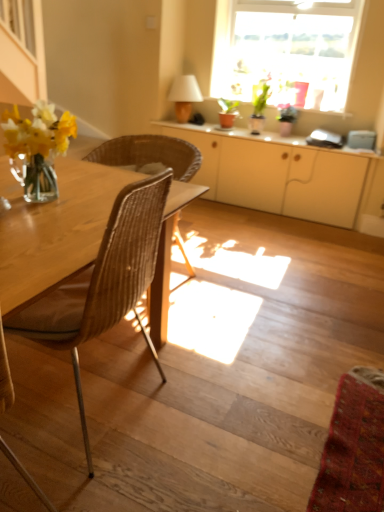
Question: Should I look upward or downward to see white glossy cabinet at center?

Choices:
 (A) down
 (B) up

Answer: (B)

Question: Should I look upward or downward to see brown woven chair at left?

Choices:
 (A) down
 (B) up

Answer: (A)

Question: Does woven wood chair at left appear on the right side of matte white cabinet at center?

Choices:
 (A) no
 (B) yes

Answer: (A)

Question: Considering the relative sizes of woven wood chair at left and matte white cabinet at center in the image provided, is woven wood chair at left thinner than matte white cabinet at center?

Choices:
 (A) no
 (B) yes

Answer: (A)

Question: Is woven wood chair at left smaller than matte white cabinet at center?

Choices:
 (A) no
 (B) yes

Answer: (B)

Question: Is there a large distance between woven wood chair at left and matte white cabinet at center?

Choices:
 (A) no
 (B) yes

Answer: (B)

Question: Can you confirm if woven wood chair at left is taller than matte white cabinet at center?

Choices:
 (A) yes
 (B) no

Answer: (A)

Question: Can you confirm if woven wood chair at left is shorter than matte white cabinet at center?

Choices:
 (A) no
 (B) yes

Answer: (A)

Question: From the image's perspective, does woven wood chair at left appear lower than wooden stairs at lower left?

Choices:
 (A) no
 (B) yes

Answer: (A)

Question: Is woven wood chair at left positioned far away from wooden stairs at lower left?

Choices:
 (A) yes
 (B) no

Answer: (B)

Question: Can wooden stairs at lower left be found inside woven wood chair at left?

Choices:
 (A) no
 (B) yes

Answer: (A)

Question: Is woven wood chair at left in contact with wooden stairs at lower left?

Choices:
 (A) no
 (B) yes

Answer: (A)

Question: From a real-world perspective, is woven wood chair at left on wooden stairs at lower left?

Choices:
 (A) yes
 (B) no

Answer: (A)

Question: Can you confirm if woven wood chair at left is smaller than wooden stairs at lower left?

Choices:
 (A) yes
 (B) no

Answer: (B)

Question: Could you tell me if white glossy cabinet at center is facing matte beige lampshade at upper center?

Choices:
 (A) yes
 (B) no

Answer: (B)